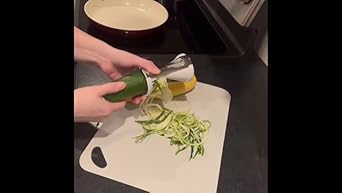
Image resolution: width=342 pixels, height=193 pixels. I want to click on plate, so click(x=177, y=167).